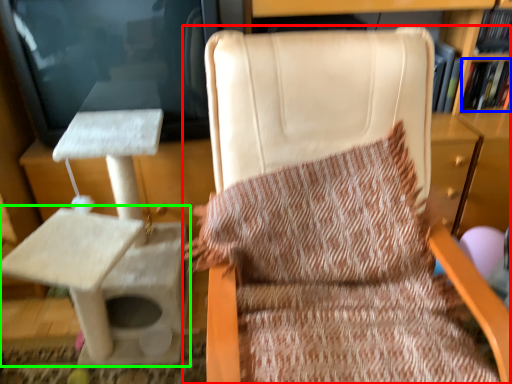
Question: Estimate the real-world distances between objects in this image. Which object is closer to chair (highlighted by a red box), book (highlighted by a blue box) or table (highlighted by a green box)?

Choices:
 (A) book
 (B) table

Answer: (B)